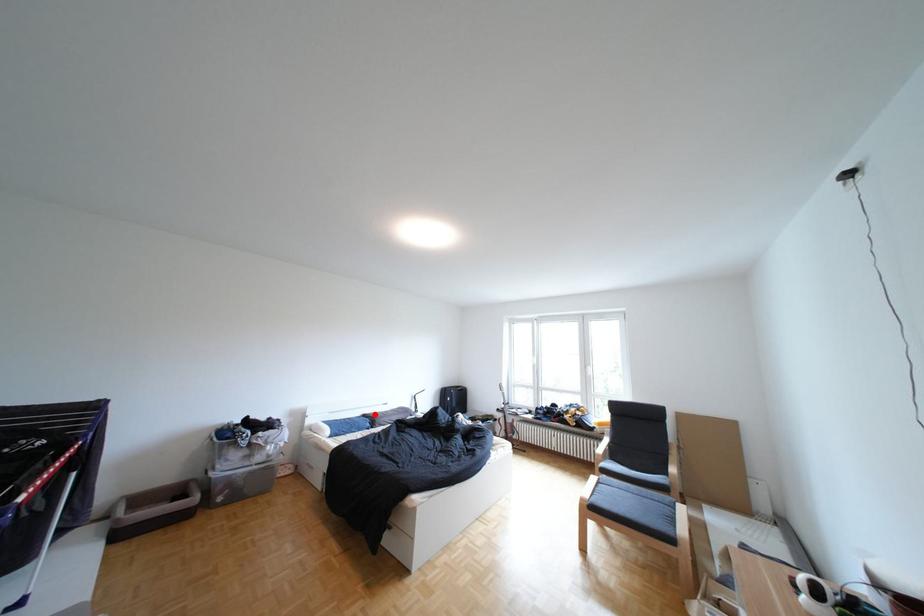
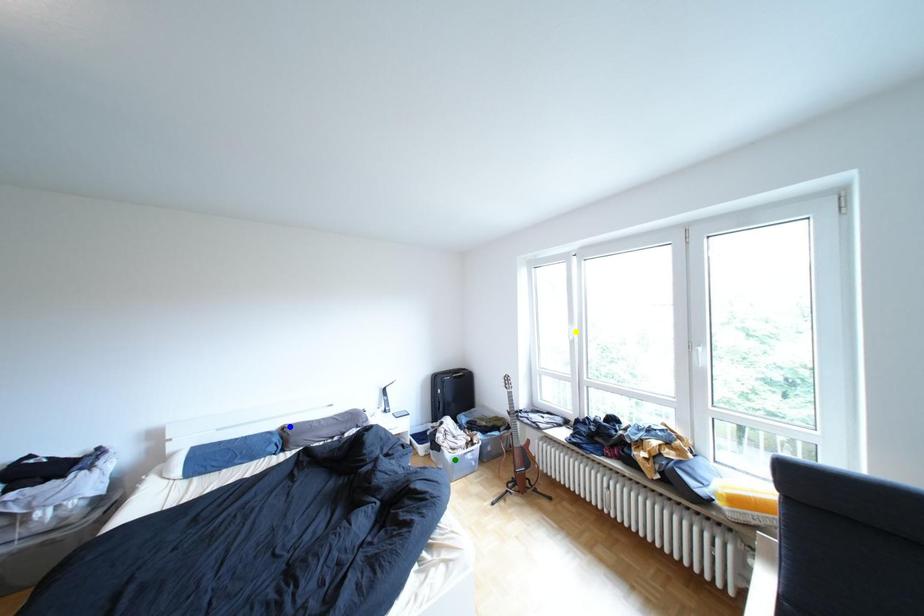
Question: I am providing you with two images of the same scene from different viewpoints. A red point is marked on the first image. You are given multiple points on the second image. Which point in image 2 is actually the same real-world point as the red point in image 1?

Choices:
 (A) green point
 (B) blue point
 (C) yellow point

Answer: (B)